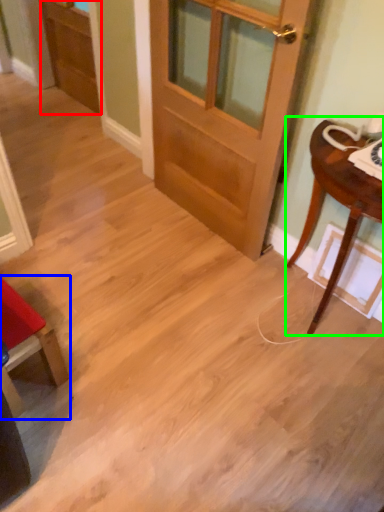
Question: Considering the real-world distances, which object is farthest from screen door (highlighted by a red box)? chair (highlighted by a blue box) or table (highlighted by a green box)?

Choices:
 (A) chair
 (B) table

Answer: (B)